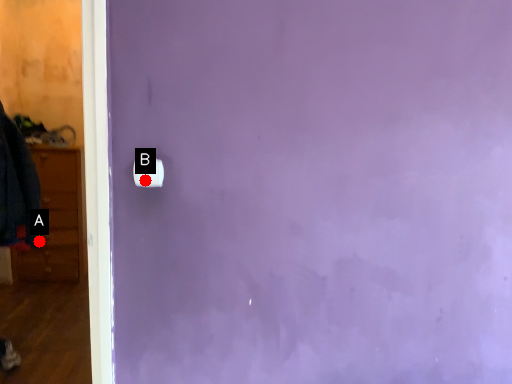
Question: Two points are circled on the image, labeled by A and B beside each circle. Among these points, which one is nearest to the camera?

Choices:
 (A) A is closer
 (B) B is closer

Answer: (B)